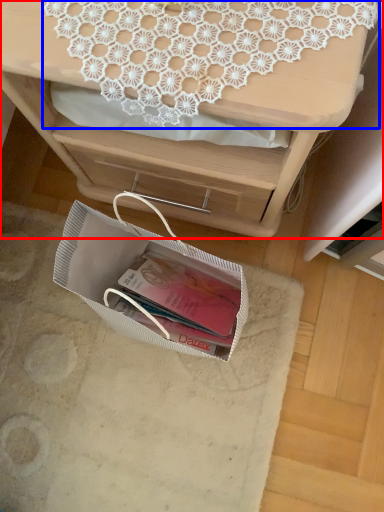
Question: Which of the following is the closest to the observer, desk (highlighted by a red box) or lace (highlighted by a blue box)?

Choices:
 (A) desk
 (B) lace

Answer: (A)